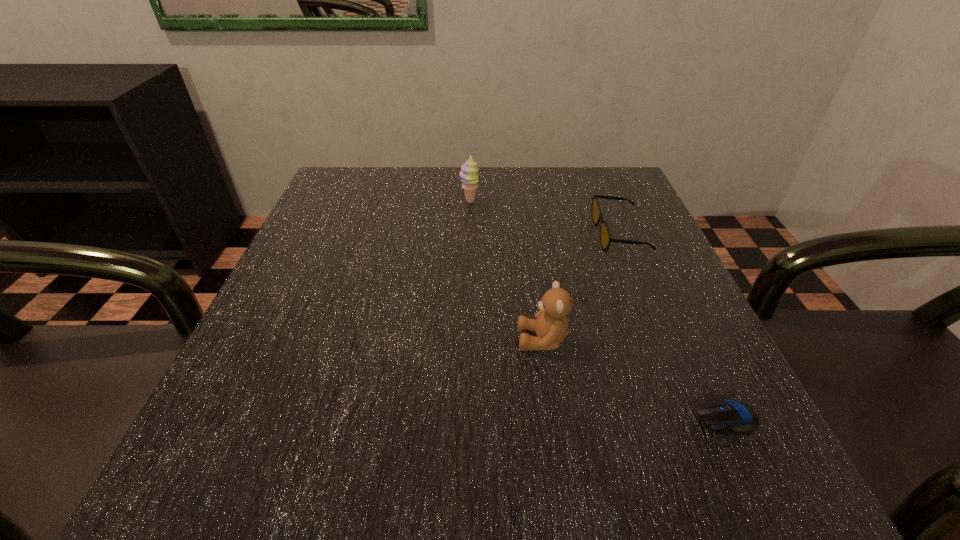
At what (x,y) coordinates should I click in order to perform the action: click on vacant space located on the face of the third object from right to left. Please return your answer as a coordinate pair (x, y). This screenshot has height=540, width=960. Looking at the image, I should click on click(411, 340).

The width and height of the screenshot is (960, 540). I want to click on vacant space located 0.250m on the face of the third object from right to left, so 360,340.

Locate an element on the screen. This screenshot has height=540, width=960. vacant region located 0.400m on the front-facing side of the sunglasses is located at coordinates (402, 235).

What are the coordinates of `vacant region located 0.280m on the front-facing side of the sunglasses` in the screenshot? It's located at (461, 235).

Locate an element on the screen. This screenshot has width=960, height=540. free space located 0.190m on the front-facing side of the sunglasses is located at coordinates (505, 235).

At what (x,y) coordinates should I click in order to perform the action: click on vacant space positioned on the button side of the computer mouse. Please return your answer as a coordinate pair (x, y). Looking at the image, I should click on (444, 416).

Where is `vacant region located 0.130m on the button side of the computer mouse`? Image resolution: width=960 pixels, height=540 pixels. vacant region located 0.130m on the button side of the computer mouse is located at coordinates point(599,416).

In order to click on blank space located on the button side of the computer mouse in this screenshot , I will do `click(659, 416)`.

This screenshot has width=960, height=540. In order to click on sherbert situated at the far edge in this screenshot , I will do `click(469, 171)`.

Identify the location of sunglasses that is at the far edge. (605, 236).